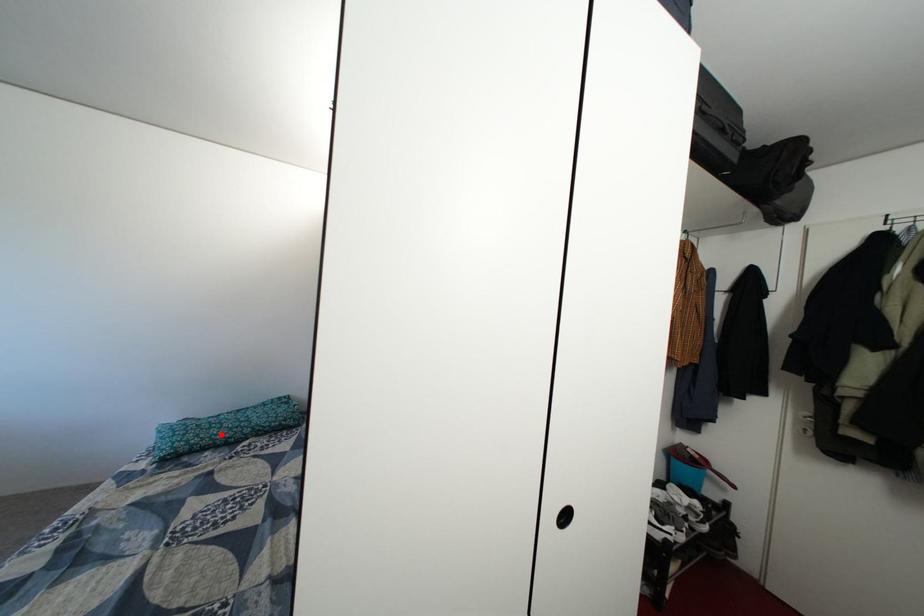
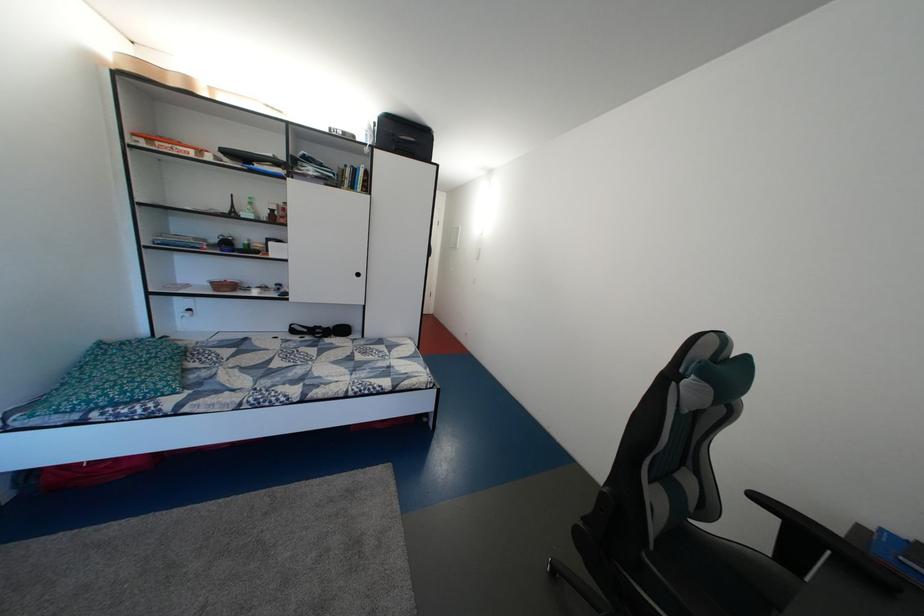
The point at the highlighted location is marked in the first image. Where is the corresponding point in the second image?

(160, 376)